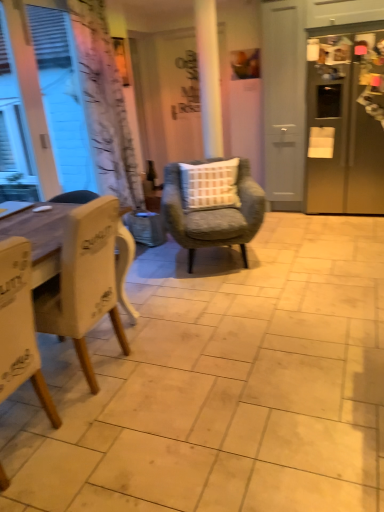
Question: Considering the positions of white wood chair at left, the first chair from the front, and satin silver refrigerator at right in the image, is white wood chair at left, the first chair from the front, taller or shorter than satin silver refrigerator at right?

Choices:
 (A) tall
 (B) short

Answer: (B)

Question: Considering the positions of white wood chair at left, which is counted as the third chair, starting from the back, and satin silver refrigerator at right in the image, is white wood chair at left, which is counted as the third chair, starting from the back, wider or thinner than satin silver refrigerator at right?

Choices:
 (A) wide
 (B) thin

Answer: (B)

Question: Based on their relative distances, which object is nearer to the textured gray armchair at center, which appears as the first chair when viewed from the back?

Choices:
 (A) white matte window screen at left
 (B) white wood chair at left, the first chair from the front
 (C) white wood chair at left, the second chair when ordered from front to back
 (D) white matte window at left
 (E) clear glass bottle at center

Answer: (C)

Question: Which of these objects is positioned closest to the white matte window at left?

Choices:
 (A) white matte window screen at left
 (B) white wood chair at left, the first chair from the front
 (C) white wood chair at left, the second chair when ordered from front to back
 (D) textured gray armchair at center, which appears as the first chair when viewed from the back
 (E) clear glass bottle at center

Answer: (A)